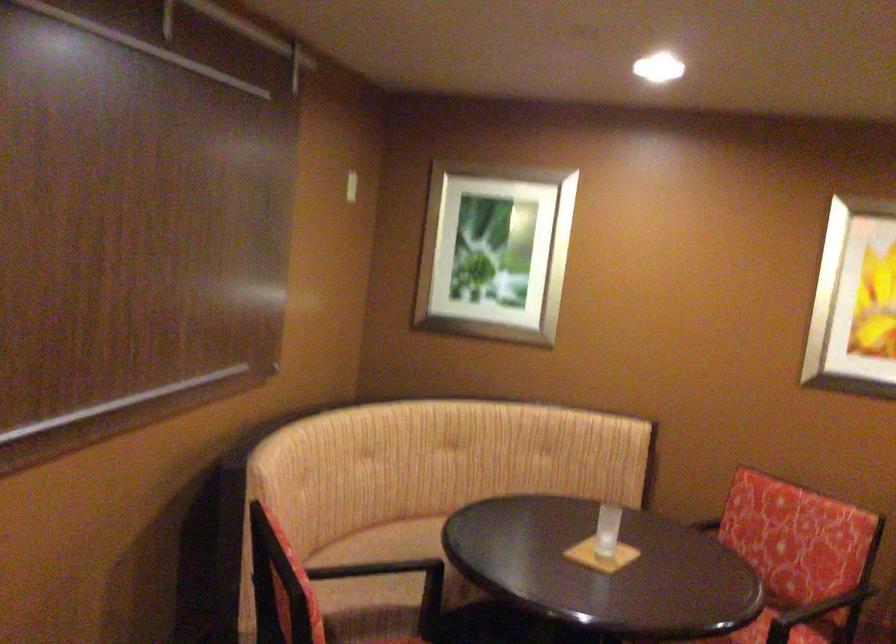
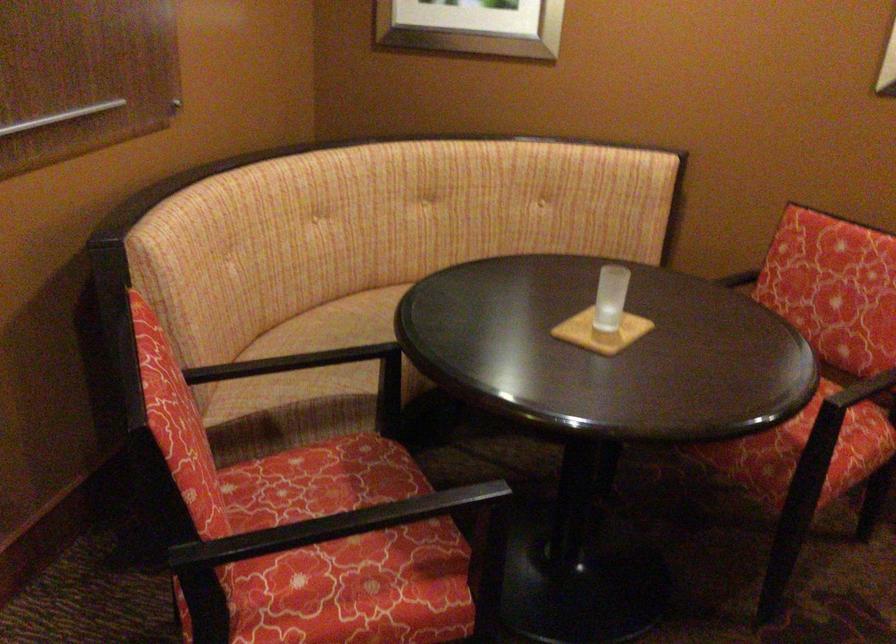
In the second image, find the point that corresponds to pixel 595 567 in the first image.

(600, 332)